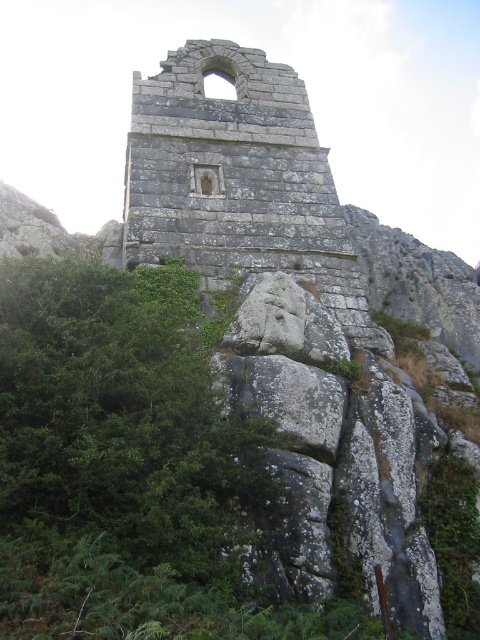
Question: Is gray stone ruins at center to the left of green leafy shrub at center from the viewer's perspective?

Choices:
 (A) yes
 (B) no

Answer: (A)

Question: Is gray stone ruins at center to the left of green leafy shrub at center from the viewer's perspective?

Choices:
 (A) yes
 (B) no

Answer: (A)

Question: Which point is closer to the camera taking this photo?

Choices:
 (A) (224, 202)
 (B) (432, 490)

Answer: (B)

Question: Which point appears farthest from the camera in this image?

Choices:
 (A) (434, 460)
 (B) (284, 108)

Answer: (B)

Question: From the image, what is the correct spatial relationship of gray stone ruins at center in relation to green leafy shrub at center?

Choices:
 (A) left
 (B) right

Answer: (A)

Question: Which object appears farthest from the camera in this image?

Choices:
 (A) green leafy shrub at center
 (B) gray stone ruins at center

Answer: (B)